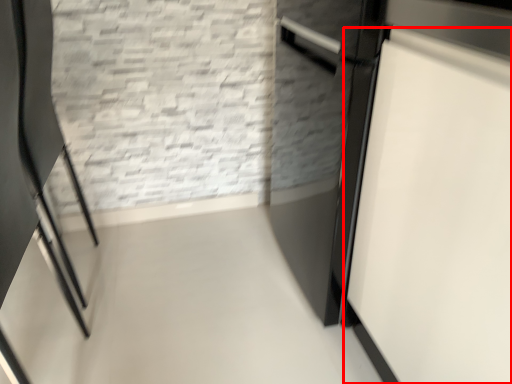
Question: From the image's perspective, where is door (annotated by the red box) located relative to chair?

Choices:
 (A) below
 (B) above

Answer: (B)